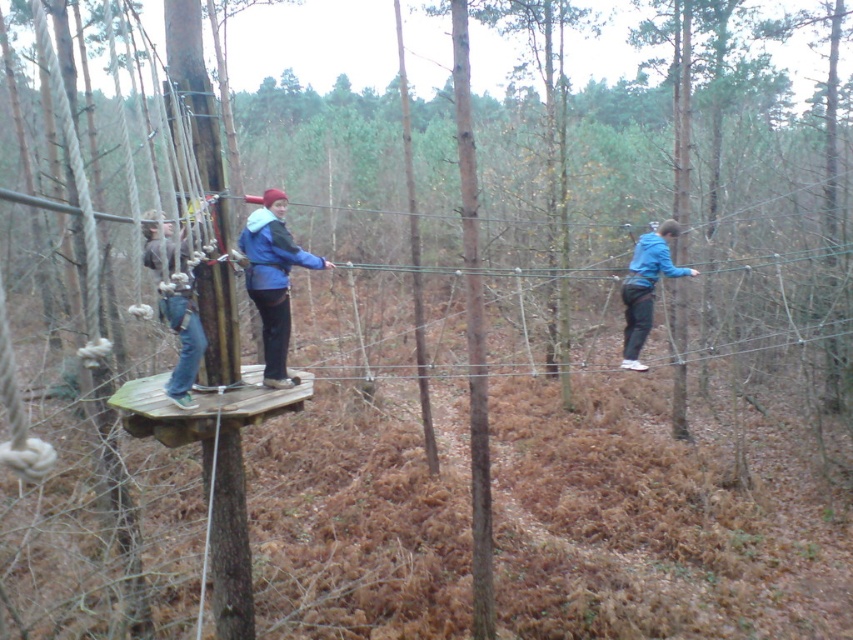
Question: Is blue fabric jacket at center in front of blue matte jacket at right?

Choices:
 (A) yes
 (B) no

Answer: (A)

Question: Which of the following is the farthest from the observer?

Choices:
 (A) blue fabric jacket at center
 (B) blue fleece jacket at center
 (C) blue matte jacket at right

Answer: (C)

Question: Can you confirm if blue fleece jacket at center is thinner than blue fabric jacket at center?

Choices:
 (A) yes
 (B) no

Answer: (B)

Question: Can you confirm if blue fleece jacket at center is positioned below blue fabric jacket at center?

Choices:
 (A) no
 (B) yes

Answer: (A)

Question: Which object is the farthest from the blue matte jacket at right?

Choices:
 (A) blue fabric jacket at center
 (B) blue fleece jacket at center

Answer: (A)

Question: Which point is closer to the camera taking this photo?

Choices:
 (A) (248, 282)
 (B) (165, 248)
 (C) (627, 310)

Answer: (B)